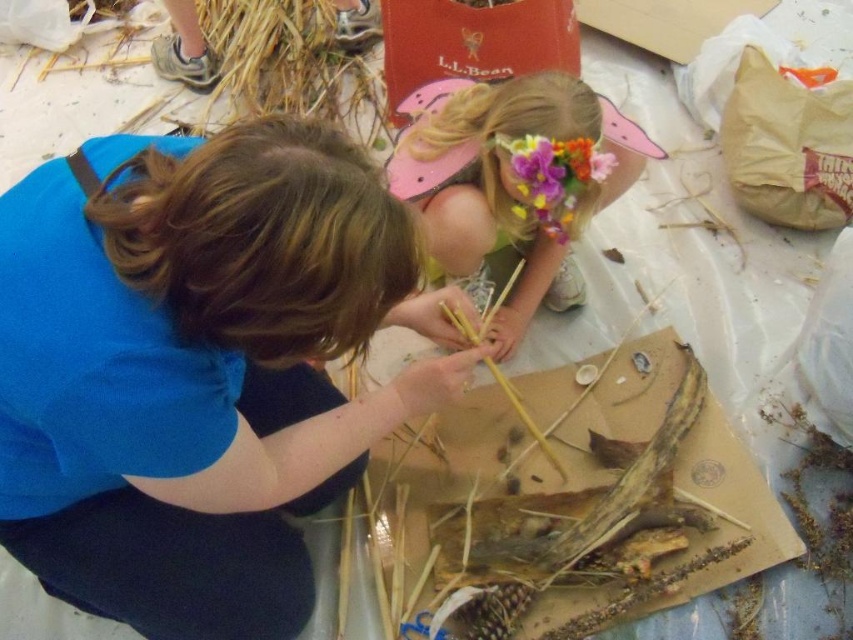
Question: Estimate the real-world distances between objects in this image. Which object is closer to the floral paper crown at upper center?

Choices:
 (A) brown cardboard at center
 (B) floral crown at upper center

Answer: (B)

Question: Which object is closer to the camera taking this photo?

Choices:
 (A) blue fabric shirt at upper left
 (B) smooth straw at center
 (C) brown cardboard at center

Answer: (A)

Question: Is blue fabric shirt at upper left below floral crown at upper center?

Choices:
 (A) yes
 (B) no

Answer: (A)

Question: In this image, where is blue fabric shirt at upper left located relative to smooth straw at center?

Choices:
 (A) right
 (B) left

Answer: (B)

Question: Does blue fabric shirt at upper left come behind smooth straw at center?

Choices:
 (A) no
 (B) yes

Answer: (A)

Question: Which object appears farthest from the camera in this image?

Choices:
 (A) brown cardboard at center
 (B) floral crown at upper center
 (C) smooth straw at center
 (D) blue fabric shirt at upper left

Answer: (C)